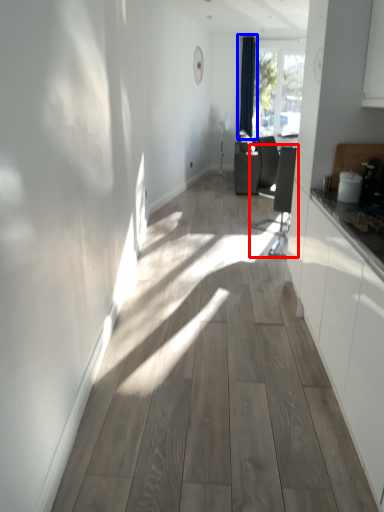
Question: Which object is further to the camera taking this photo, swivel chair (highlighted by a red box) or curtain (highlighted by a blue box)?

Choices:
 (A) swivel chair
 (B) curtain

Answer: (B)